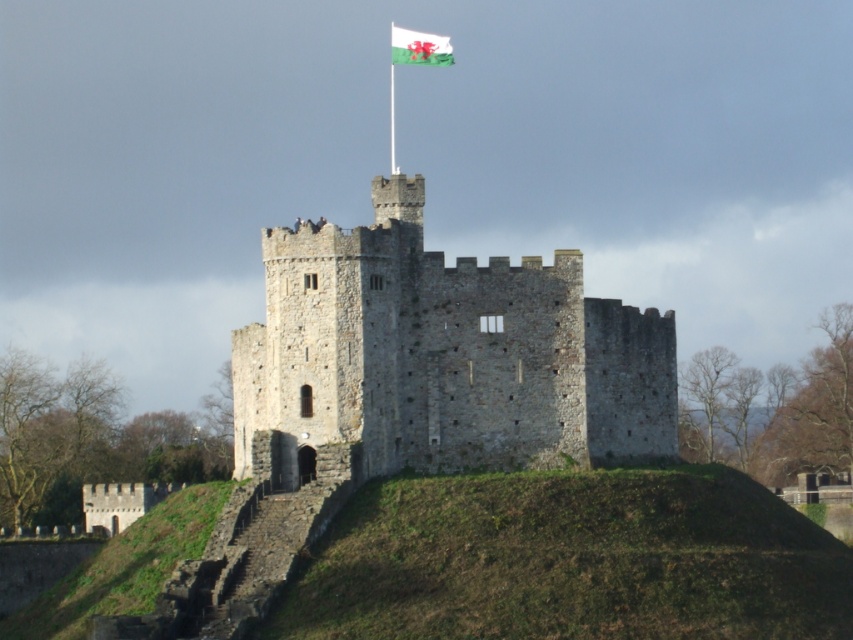
You are a castle tour guide explaining the flag and pole to visitors. Which object is bigger between the white fabric flag at top and the green metallic pole at upper center?

The white fabric flag at top is larger in size than the green metallic pole at upper center.

You are standing in front of the historic stone castle and want to determine the relative positions of two points marked in the image. Which point, point 1 at coordinates (x=357, y=429) or point 2 at coordinates (x=390, y=77), is closer to you?

Point 1 at coordinates (x=357, y=429) is closer to the viewer than point 2 at coordinates (x=390, y=77).

You are a castle tour guide standing at the base of the stone castle at center. You want to point out the white fabric flag at top to your visitors. How far vertically above the castle base is the flag?

The white fabric flag at top is 82.11 feet vertically above the stone castle at center.